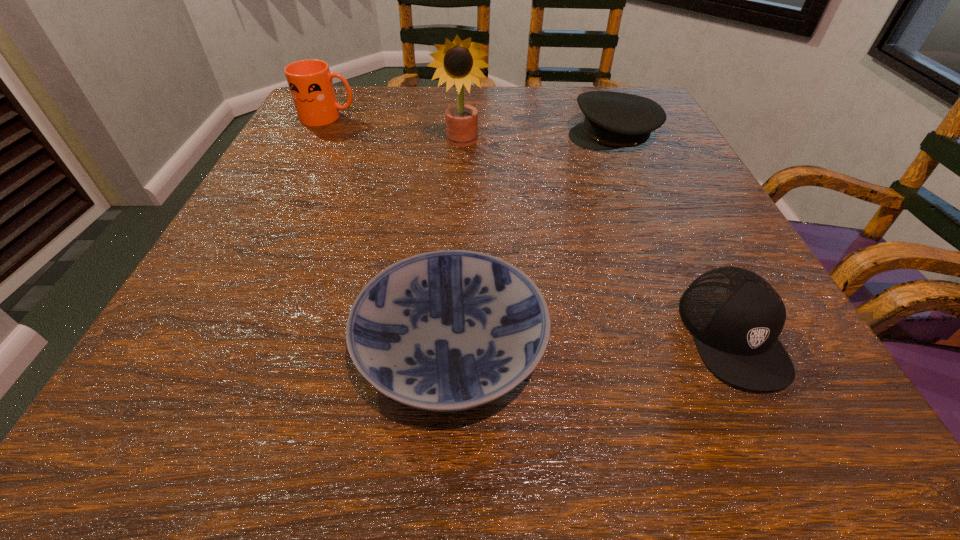
Find the location of a particular element. The image size is (960, 540). free space that satisfies the following two spatial constraints: 1. on the front-facing side of the beret; 2. on the face of the tallest object is located at coordinates [615, 142].

Where is `blank area in the image that satisfies the following two spatial constraints: 1. on the face of the sunflower; 2. on the left side of the shortest object`? The image size is (960, 540). blank area in the image that satisfies the following two spatial constraints: 1. on the face of the sunflower; 2. on the left side of the shortest object is located at coordinates (450, 346).

Image resolution: width=960 pixels, height=540 pixels. What are the coordinates of `vacant space that satisfies the following two spatial constraints: 1. on the front-facing side of the beret; 2. on the face of the tallest object` in the screenshot? It's located at (615, 142).